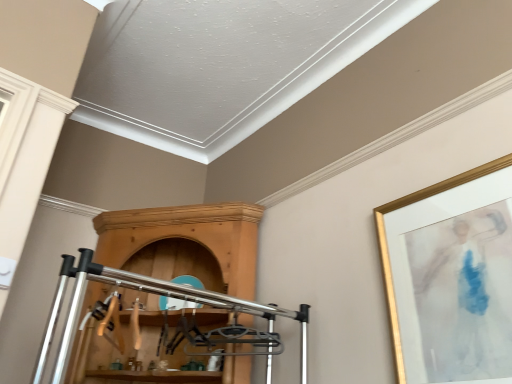
Question: Considering the positions of gold-framed artwork at upper right and wooden cabinet at center in the image, is gold-framed artwork at upper right taller or shorter than wooden cabinet at center?

Choices:
 (A) tall
 (B) short

Answer: (B)

Question: Is gold-framed artwork at upper right spatially inside wooden cabinet at center, or outside of it?

Choices:
 (A) inside
 (B) outside

Answer: (B)

Question: Considering the relative positions of gold-framed artwork at upper right and wooden cabinet at center in the image provided, is gold-framed artwork at upper right to the left or to the right of wooden cabinet at center?

Choices:
 (A) left
 (B) right

Answer: (B)

Question: Would you say wooden cabinet at center is to the left or to the right of gold-framed artwork at upper right in the picture?

Choices:
 (A) left
 (B) right

Answer: (A)

Question: In the image, is wooden cabinet at center positioned in front of or behind gold-framed artwork at upper right?

Choices:
 (A) behind
 (B) front

Answer: (A)

Question: Based on their sizes in the image, would you say wooden cabinet at center is bigger or smaller than gold-framed artwork at upper right?

Choices:
 (A) small
 (B) big

Answer: (B)

Question: Does point (176, 382) appear closer or farther from the camera than point (471, 379)?

Choices:
 (A) farther
 (B) closer

Answer: (A)